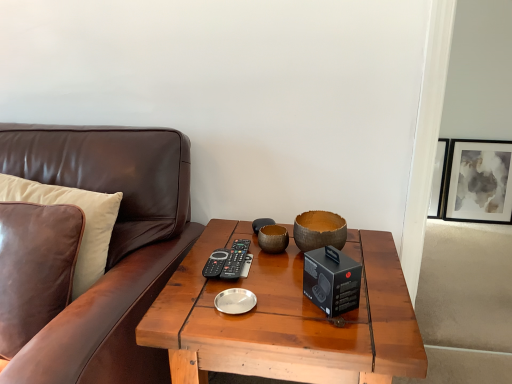
Find the location of `empty space that is ontop of wooden coffee table at center`. empty space that is ontop of wooden coffee table at center is located at coordinates (282, 284).